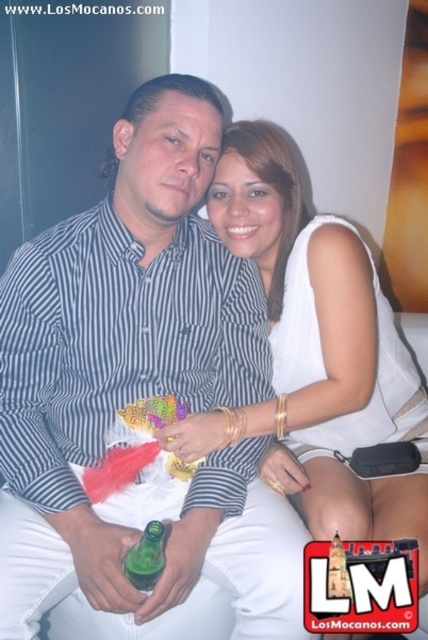
Question: Which of the following is the closest to the observer?

Choices:
 (A) (177, 269)
 (B) (341, 358)
 (C) (152, 548)

Answer: (C)

Question: Estimate the real-world distances between objects in this image. Which object is farther from the white satin dress at center?

Choices:
 (A) green glass bottle at center
 (B) striped cotton shirt at center

Answer: (A)

Question: Does striped cotton shirt at center lie in front of green glass bottle at center?

Choices:
 (A) no
 (B) yes

Answer: (A)

Question: Among these points, which one is farthest from the camera?

Choices:
 (A) [172, 227]
 (B) [332, 483]

Answer: (B)

Question: Can you confirm if striped cotton shirt at center is bigger than white satin dress at center?

Choices:
 (A) yes
 (B) no

Answer: (B)

Question: Is striped cotton shirt at center further to the viewer compared to white satin dress at center?

Choices:
 (A) no
 (B) yes

Answer: (A)